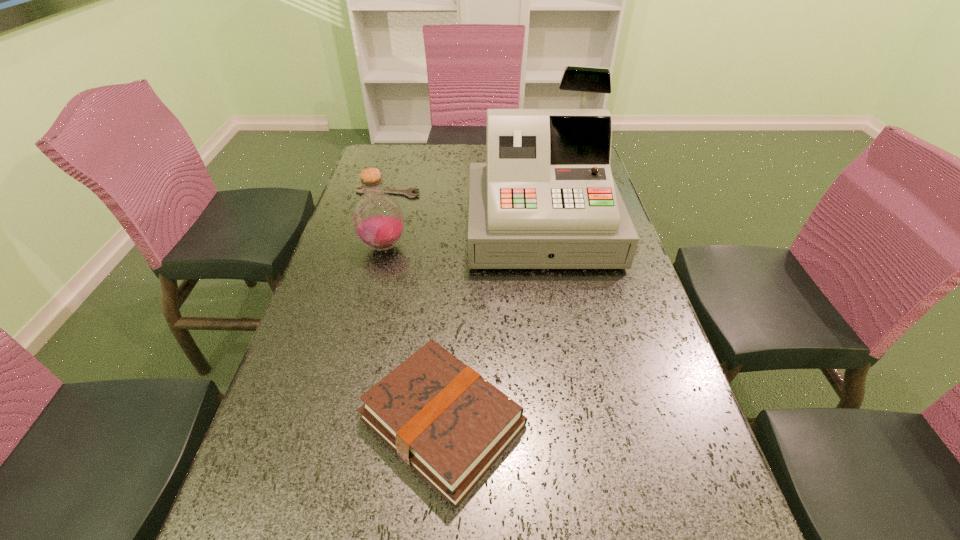
The image size is (960, 540). What are the coordinates of `wrench at the left edge` in the screenshot? It's located at (407, 192).

Identify the location of object positioned at the right edge. (545, 199).

Locate an element on the screen. This screenshot has width=960, height=540. vacant space at the far edge is located at coordinates (474, 152).

Where is `vacant space at the left edge of the desktop`? vacant space at the left edge of the desktop is located at coordinates (397, 186).

Identify the location of vacant area at the right edge of the desktop. The width and height of the screenshot is (960, 540). tap(641, 527).

Where is `vacant area between the tallest object and the shortest object`? vacant area between the tallest object and the shortest object is located at coordinates (x=465, y=210).

At what (x,y) coordinates should I click in order to perform the action: click on empty space between the bottle and the tallest object. Please return your answer as a coordinate pair (x, y). Looking at the image, I should click on (463, 237).

At what (x,y) coordinates should I click in order to perform the action: click on free spot between the hardback book and the second tallest object. Please return your answer as a coordinate pair (x, y). Image resolution: width=960 pixels, height=540 pixels. Looking at the image, I should click on (414, 334).

Identify the location of free spot between the third tallest object and the wrench. This screenshot has height=540, width=960. (416, 307).

Identify the location of vacant area that lies between the bottle and the tallest object. The width and height of the screenshot is (960, 540). (463, 237).